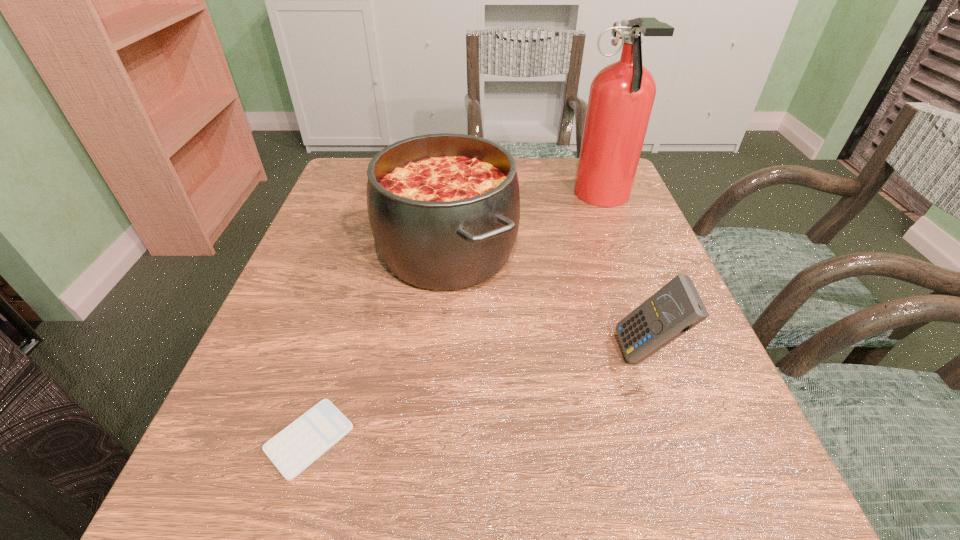
At what (x,y) coordinates should I click in order to perform the action: click on object positioned at the near left corner. Please return your answer as a coordinate pair (x, y). The image size is (960, 540). Looking at the image, I should click on (296, 447).

Image resolution: width=960 pixels, height=540 pixels. Identify the location of object present at the far right corner. (622, 94).

Where is `blank space at the far edge of the desktop`? blank space at the far edge of the desktop is located at coordinates (523, 165).

This screenshot has width=960, height=540. Find the location of `vacant space at the near edge`. vacant space at the near edge is located at coordinates (435, 488).

Where is `blank space at the left edge`? The width and height of the screenshot is (960, 540). blank space at the left edge is located at coordinates (359, 321).

Locate an element on the screen. This screenshot has height=540, width=960. free space at the right edge of the desktop is located at coordinates (660, 264).

Locate an element on the screen. The width and height of the screenshot is (960, 540). free space at the near left corner is located at coordinates (179, 523).

In order to click on free region at the far right corner of the desktop in this screenshot , I will do `click(577, 201)`.

In the image, there is a desktop. Where is `blank space at the near right corner`? The image size is (960, 540). blank space at the near right corner is located at coordinates (681, 529).

This screenshot has height=540, width=960. What are the coordinates of `free space that is in between the tallest object and the casserole` in the screenshot? It's located at (525, 224).